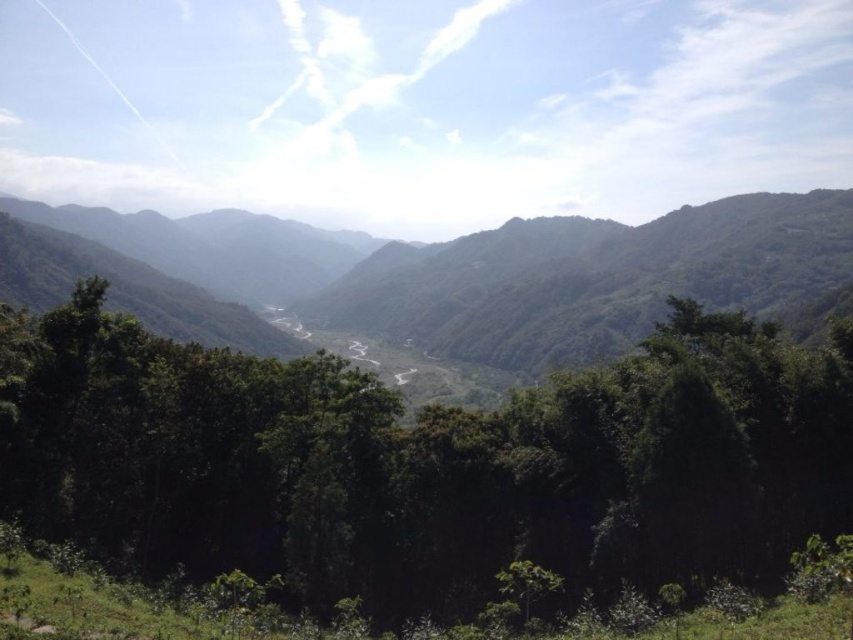
You are a hiker standing at the edge of the valley looking towards the center of the image. Which object, the green leafy tree at center or the green leafy mountain at center, is closer to you?

The green leafy tree at center is closer to you as it is positioned in front of the green leafy mountain at center.

You are standing in a lush mountain landscape and see a green leafy tree at center. If you want to reach the tree within 2 minutes, what is the minimum speed you need to walk at?

The green leafy tree at center is 16.40 meters away. To reach it in 2 minutes, you need to walk at a minimum speed of 0.137 meters per second.

You are an environmental scientist examining the landscape. You notice the green leafy tree at center and the green leafy mountain at center. Which one has a greater height?

The green leafy mountain at center is taller than the green leafy tree at center according to the description.